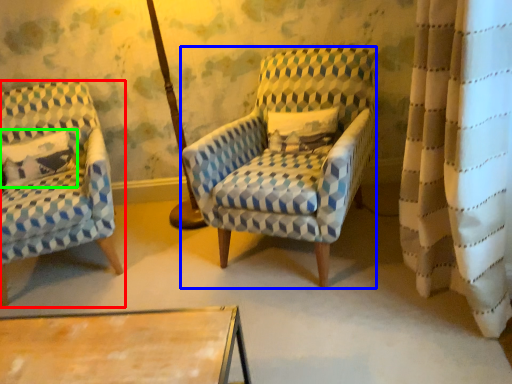
Question: Considering the real-world distances, which object is closest to chair (highlighted by a red box)? chair (highlighted by a blue box) or pillow (highlighted by a green box).

Choices:
 (A) chair
 (B) pillow

Answer: (B)